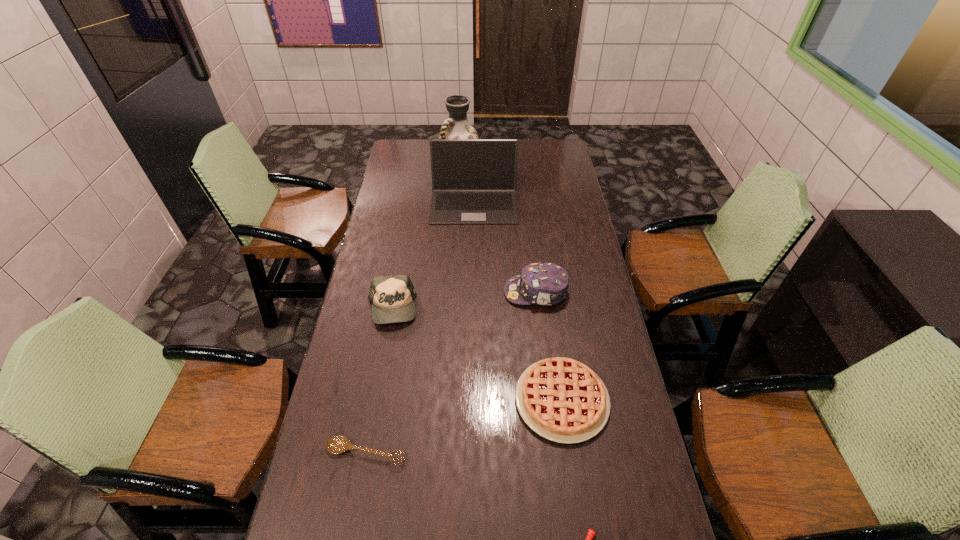
Locate which object is the fourth closest to the headwear. Please provide its 2D coordinates. Your answer should be formatted as a tuple, i.e. [(x, y)], where the tuple contains the x and y coordinates of a point satisfying the conditions above.

[(337, 444)]

You are a GUI agent. You are given a task and a screenshot of the screen. Output one action in this format:
    pyautogui.click(x=<x>, y=<y>)
    Task: Click on the free space that satisfies the following two spatial constraints: 1. on the front-facing side of the fifth shortest object; 2. on the right side of the third shortest object
    
    Given the screenshot: What is the action you would take?
    pyautogui.click(x=549, y=400)

This screenshot has height=540, width=960. Find the location of `free space that satisfies the following two spatial constraints: 1. on the front side of the vase; 2. on the left side of the pie`. free space that satisfies the following two spatial constraints: 1. on the front side of the vase; 2. on the left side of the pie is located at coordinates (444, 400).

This screenshot has height=540, width=960. Identify the location of free space in the image that satisfies the following two spatial constraints: 1. on the front-facing side of the fifth shortest object; 2. on the right side of the pie. (549, 400).

Locate an element on the screen. vacant space that satisfies the following two spatial constraints: 1. on the front-facing side of the headwear; 2. on the front-facing side of the baseball cap is located at coordinates (538, 308).